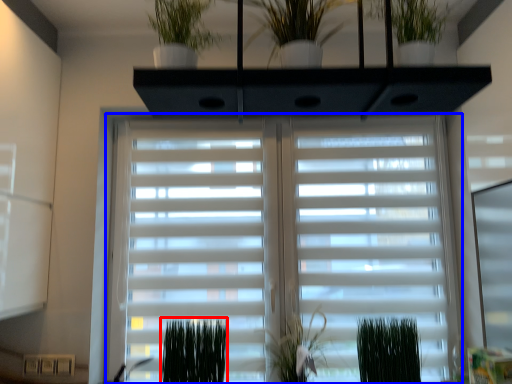
Question: Which object is further to the camera taking this photo, plant (highlighted by a red box) or window blind (highlighted by a blue box)?

Choices:
 (A) plant
 (B) window blind

Answer: (B)